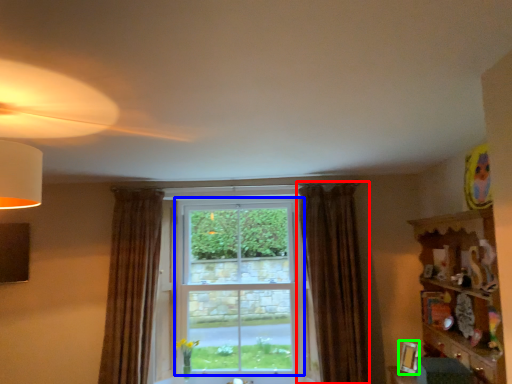
Question: Which is farther away from curtain (highlighted by a red box)? window (highlighted by a blue box) or picture frame (highlighted by a green box)?

Choices:
 (A) window
 (B) picture frame

Answer: (A)